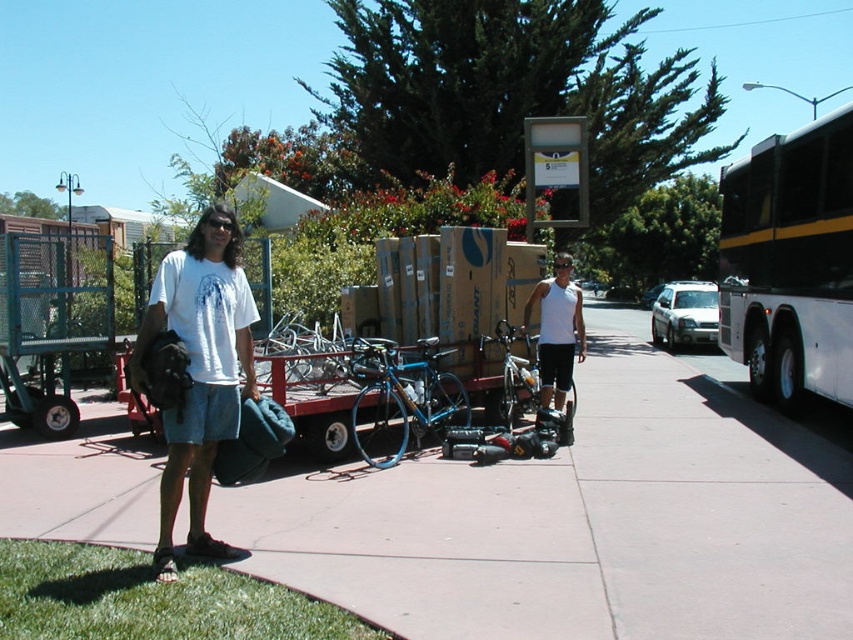
Between smooth concrete sidewalk at center and blue metallic bicycle at center, which one appears on the left side from the viewer's perspective?

blue metallic bicycle at center

Who is shorter, smooth concrete sidewalk at center or blue metallic bicycle at center?

smooth concrete sidewalk at center is shorter.

Locate an element on the screen. smooth concrete sidewalk at center is located at coordinates (582, 518).

Identify the location of smooth concrete sidewalk at center. (582, 518).

Who is more distant from viewer, [235,556] or [547,387]?

Positioned behind is point [547,387].

Between point (212, 292) and point (540, 368), which one is positioned in front?

Point (212, 292)

Who is more forward, (202, 460) or (555, 316)?

Point (202, 460) is in front.

Locate an element on the screen. white cotton t-shirt at left is located at coordinates (198, 371).

Is blue metallic bicycle at center to the right of white matte tank top at center from the viewer's perspective?

Incorrect, blue metallic bicycle at center is not on the right side of white matte tank top at center.

Which is below, blue metallic bicycle at center or white matte tank top at center?

Positioned lower is blue metallic bicycle at center.

The height and width of the screenshot is (640, 853). I want to click on blue metallic bicycle at center, so click(401, 397).